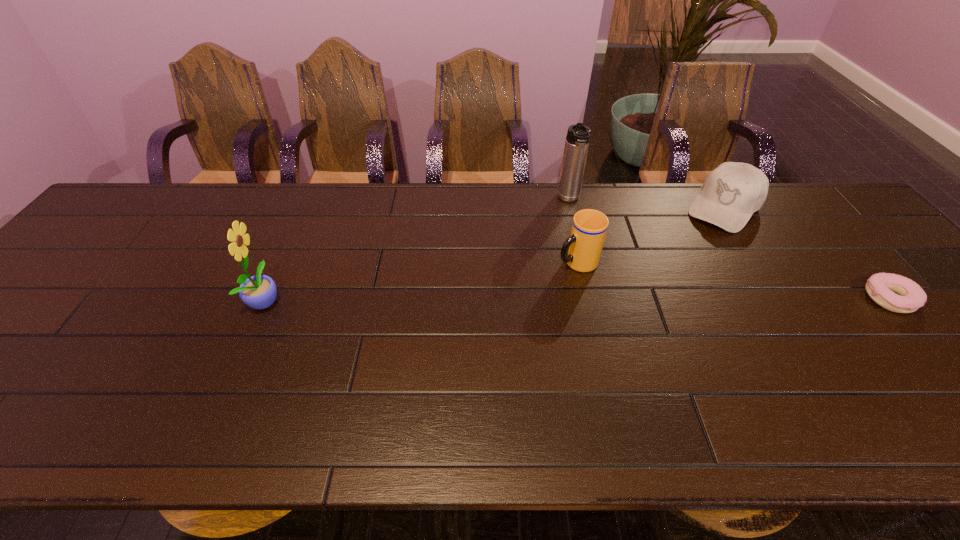
Where is `vacant area that lies between the cup and the rightmost object`? This screenshot has height=540, width=960. vacant area that lies between the cup and the rightmost object is located at coordinates (732, 280).

Locate which object ranks in proximity to the leftmost object. Please provide its 2D coordinates. Your answer should be formatted as a tuple, i.e. [(x, y)], where the tuple contains the x and y coordinates of a point satisfying the conditions above.

[(582, 250)]

At what (x,y) coordinates should I click in order to perform the action: click on object that is the third closest one to the second object from right to left. Please return your answer as a coordinate pair (x, y). The height and width of the screenshot is (540, 960). Looking at the image, I should click on (582, 250).

Identify the location of vacant area that satisfies the following two spatial constraints: 1. on the front side of the cup; 2. on the right side of the doughnut. The width and height of the screenshot is (960, 540). (585, 298).

Locate an element on the screen. The height and width of the screenshot is (540, 960). vacant space that satisfies the following two spatial constraints: 1. on the back side of the fourth object from left to right; 2. on the left side of the cup is located at coordinates (564, 208).